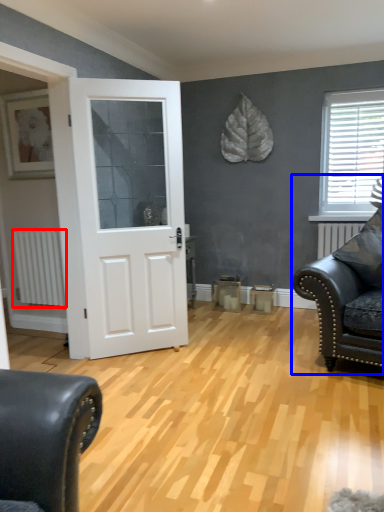
Question: Among these objects, which one is farthest to the camera, radiator (highlighted by a red box) or studio couch (highlighted by a blue box)?

Choices:
 (A) radiator
 (B) studio couch

Answer: (A)